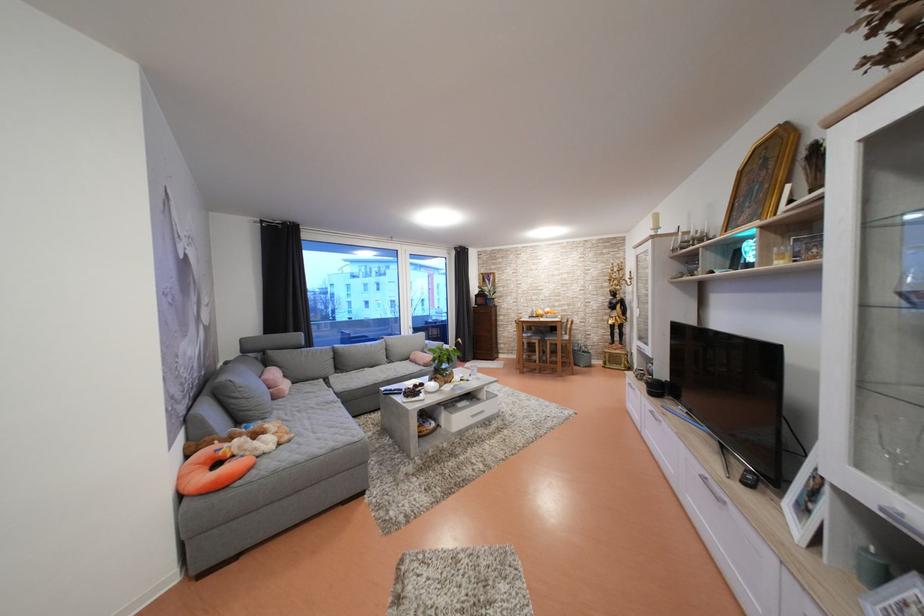
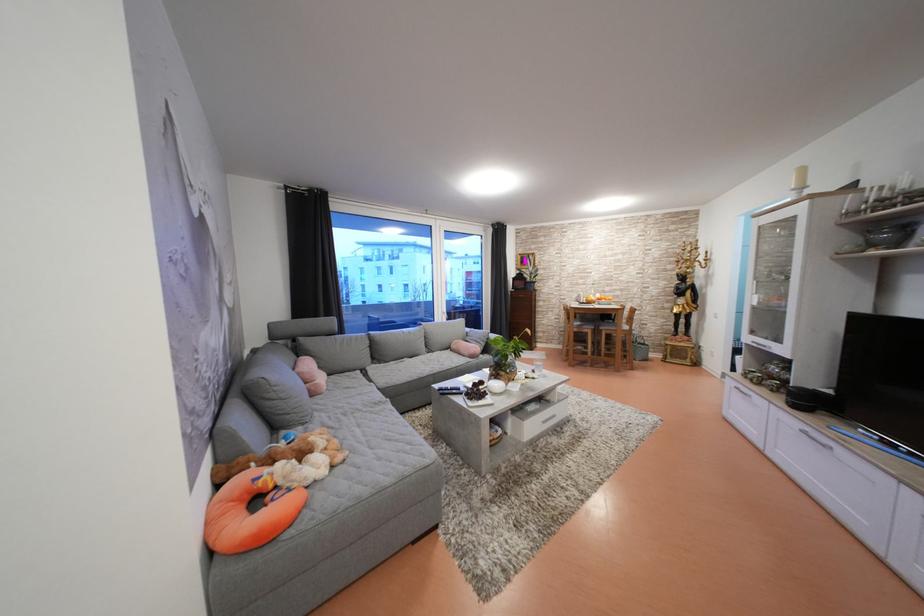
Question: The images are taken continuously from a first-person perspective. In which direction is your viewpoint rotating?

Choices:
 (A) Left
 (B) Right
 (C) Up
 (D) Down

Answer: (D)